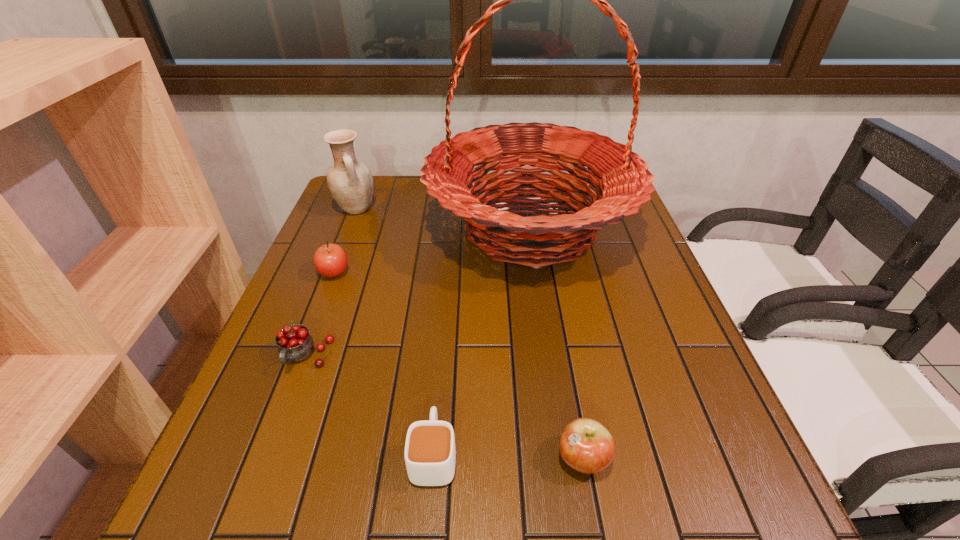
Locate an element on the screen. This screenshot has height=540, width=960. pottery that is positioned at the left edge is located at coordinates (350, 183).

Identify the location of apple at the left edge. (330, 260).

Locate an element on the screen. The width and height of the screenshot is (960, 540). cherry that is at the left edge is located at coordinates (295, 343).

What are the coordinates of `object situated at the right edge` in the screenshot? It's located at (621, 178).

Identify the location of object that is positioned at the far left corner. This screenshot has height=540, width=960. (350, 183).

Find the location of a particular element. object situated at the far right corner is located at coordinates (621, 178).

The height and width of the screenshot is (540, 960). Identify the location of free region at the far edge of the desktop. (408, 175).

You are a GUI agent. You are given a task and a screenshot of the screen. Output one action in this format:
    pyautogui.click(x=<x>, y=<y>)
    Task: Click on the free region at the near edge of the desktop
    This screenshot has height=540, width=960.
    Given the screenshot: What is the action you would take?
    pyautogui.click(x=416, y=509)

At what (x,y) coordinates should I click in order to perform the action: click on free region at the left edge of the desktop. Please return your answer as a coordinate pair (x, y). Image resolution: width=960 pixels, height=540 pixels. Looking at the image, I should click on (292, 420).

In order to click on vacant space at the right edge of the desktop in this screenshot , I will do `click(650, 301)`.